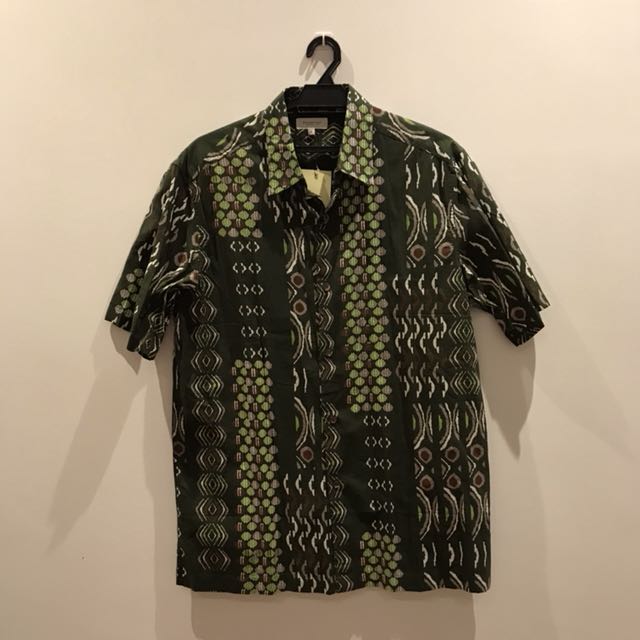
This screenshot has height=640, width=640. In order to click on wall hook in this screenshot , I will do `click(323, 43)`.